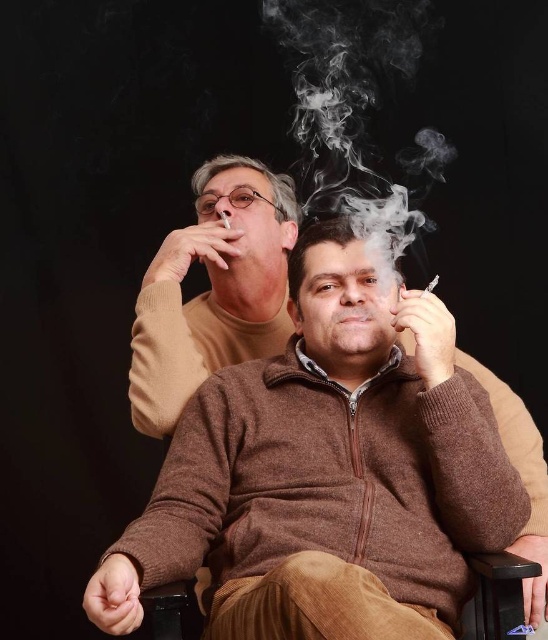
Question: Does white smoke at center appear on the right side of matte brown cigarette at upper center?

Choices:
 (A) yes
 (B) no

Answer: (A)

Question: Can you confirm if smooth silver cigarette at center is bigger than matte brown cigarette at upper center?

Choices:
 (A) no
 (B) yes

Answer: (B)

Question: Where is white smoke at center located in relation to smooth silver cigarette at center in the image?

Choices:
 (A) left
 (B) right

Answer: (A)

Question: Considering the real-world distances, which object is farthest from the matte brown cigarette at upper center?

Choices:
 (A) smooth silver cigarette at center
 (B) white smoke at center

Answer: (B)

Question: Among these points, which one is nearest to the camera?

Choices:
 (A) (429, 285)
 (B) (256, 221)

Answer: (A)

Question: Which point appears farthest from the camera in this image?

Choices:
 (A) (224, 220)
 (B) (435, 278)
 (C) (322, 106)

Answer: (C)